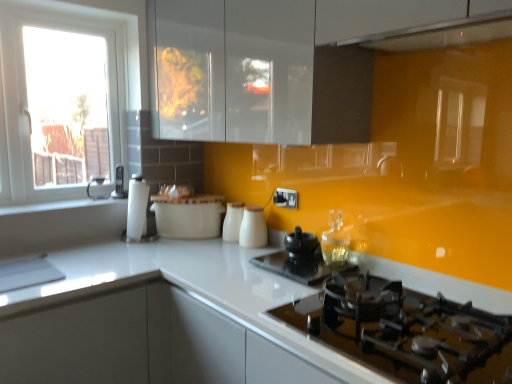
Question: Visually, is white glossy milk jugs at center, which is counted as the second kitchen appliance, starting from the left, positioned to the left or to the right of matte black kettle at left, which is the first appliance in left-to-right order?

Choices:
 (A) right
 (B) left

Answer: (A)

Question: Is white glossy milk jugs at center, which is counted as the second kitchen appliance, starting from the left, inside or outside of matte black kettle at left, the 1th appliance positioned from the top?

Choices:
 (A) inside
 (B) outside

Answer: (B)

Question: Which of these objects is positioned closest to the black glass gas stove at lower right?

Choices:
 (A) white glossy milk jugs at center, which is counted as the second kitchen appliance, starting from the left
 (B) white glossy cabinet at lower left
 (C) black ceramic kettle at center, which appears as the second appliance when viewed from the top
 (D) matte black kettle at left, marked as the third appliance in a right-to-left arrangement
 (E) white ceramic bowl at center, which is counted as the third kitchen appliance, starting from the right

Answer: (C)

Question: Based on their relative distances, which object is nearer to the black ceramic kettle at center, marked as the 2th appliance in a bottom-to-top arrangement?

Choices:
 (A) white glossy milk jugs at center, which is the 3th kitchen appliance in left-to-right order
 (B) matte black kettle at left, acting as the 3th appliance starting from the bottom
 (C) black glass gas stove at lower right
 (D) white glossy cabinet at lower left
 (E) white ceramic bowl at center, which is counted as the third kitchen appliance, starting from the right

Answer: (A)